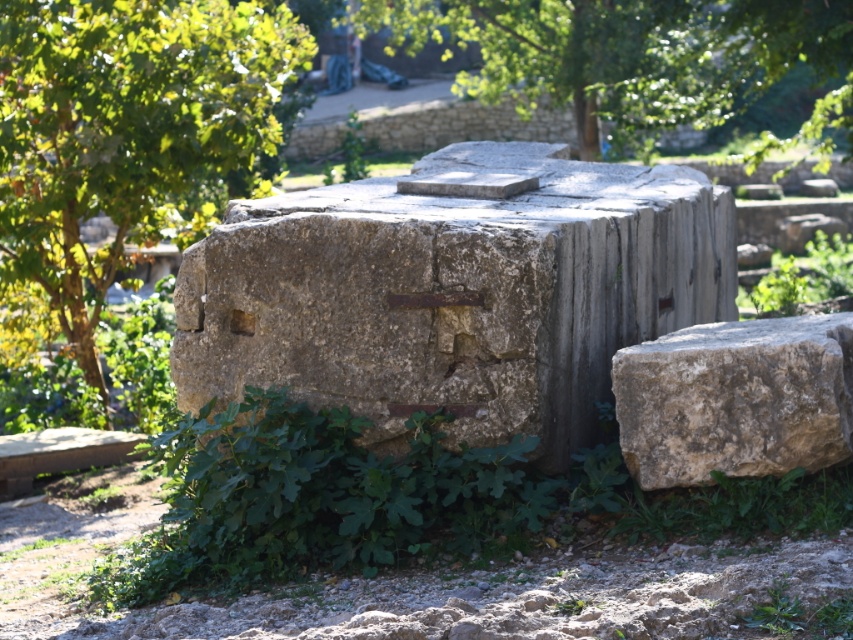
Question: Which is farther from the green leafy tree at lower left?

Choices:
 (A) rusty stone millstone at center
 (B) green leafy tree at upper center
 (C) natural stone boulder at lower right

Answer: (B)

Question: Is rusty stone millstone at center further to the viewer compared to natural stone boulder at lower right?

Choices:
 (A) yes
 (B) no

Answer: (A)

Question: Does green leafy tree at lower left come behind natural stone boulder at lower right?

Choices:
 (A) no
 (B) yes

Answer: (B)

Question: Where is rusty stone millstone at center located in relation to green leafy tree at upper center in the image?

Choices:
 (A) right
 (B) left

Answer: (B)

Question: Among these points, which one is farthest from the camera?

Choices:
 (A) pos(117,145)
 (B) pos(714,378)
 (C) pos(612,147)

Answer: (C)

Question: Which object appears closest to the camera in this image?

Choices:
 (A) green leafy tree at lower left
 (B) rusty stone millstone at center

Answer: (B)